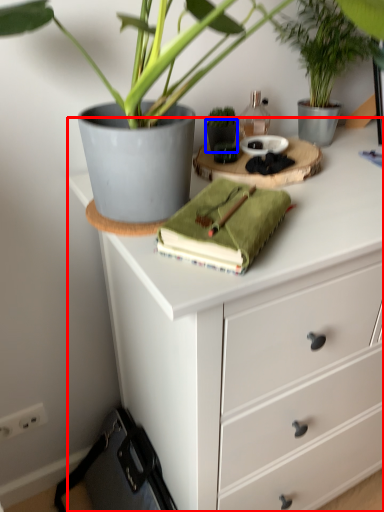
Question: Which object appears farthest to the camera in this image, chest of drawers (highlighted by a red box) or flowerpot (highlighted by a blue box)?

Choices:
 (A) chest of drawers
 (B) flowerpot

Answer: (B)